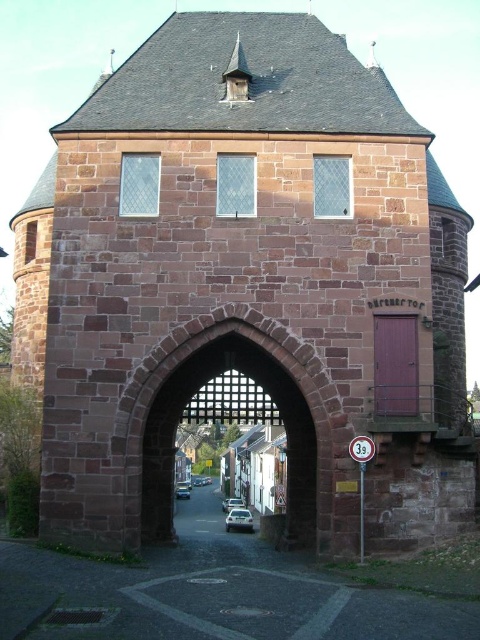
You are a medieval architect designing a new pathway leading to the historic stone gatehouse. The pathway must be wide enough to accommodate a horse and carriage. Given the dimensions of the brown stone alley at center and the reddish stone archway at center, which object should the pathway be designed to match in width to ensure compatibility?

The brown stone alley at center is wider than the reddish stone archway at center. Therefore, the pathway should be designed to match the width of the reddish stone archway at center to ensure that it can pass through the narrower entrance without obstruction.

You are standing at the entrance of the historic stone gatehouse and notice a point marked at coordinates (210, 595). Based on the scene description, can you determine what surface this point is located on?

The point is located on the brown stone alley at center.